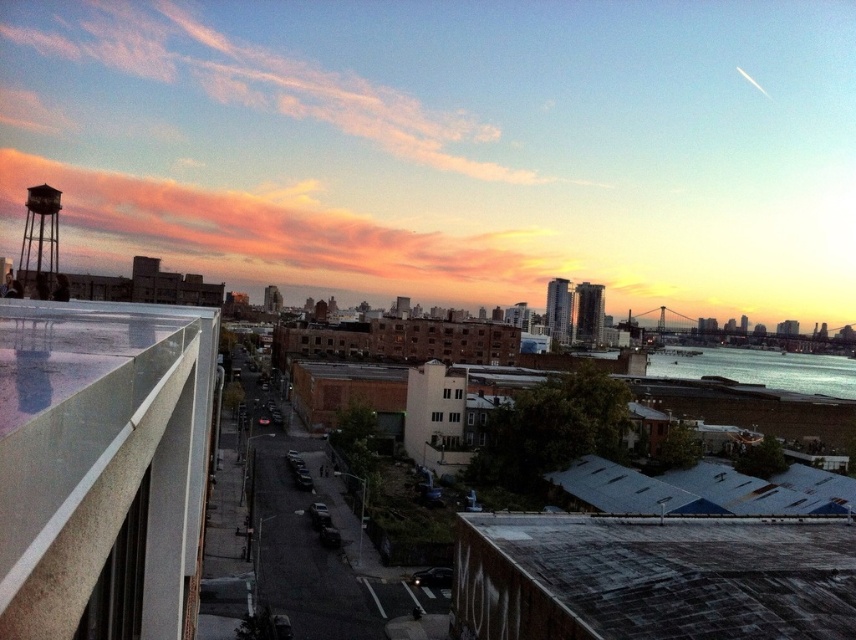
Does transparent glass balcony at upper left have a larger size compared to metallic water tower at upper left?

Incorrect, transparent glass balcony at upper left is not larger than metallic water tower at upper left.

Does transparent glass balcony at upper left have a greater width compared to metallic water tower at upper left?

In fact, transparent glass balcony at upper left might be narrower than metallic water tower at upper left.

Where is `transparent glass balcony at upper left`? This screenshot has width=856, height=640. transparent glass balcony at upper left is located at coordinates (98, 454).

Locate an element on the screen. Image resolution: width=856 pixels, height=640 pixels. transparent glass balcony at upper left is located at coordinates (98, 454).

Is transparent glass balcony at upper left positioned at the back of blue water at lower right?

No, transparent glass balcony at upper left is in front of blue water at lower right.

Is point (179, 321) in front of point (688, 378)?

Yes.

Locate an element on the screen. The image size is (856, 640). transparent glass balcony at upper left is located at coordinates (98, 454).

The height and width of the screenshot is (640, 856). What do you see at coordinates (758, 369) in the screenshot?
I see `blue water at lower right` at bounding box center [758, 369].

Is blue water at lower right below metallic water tower at upper left?

Correct, blue water at lower right is located below metallic water tower at upper left.

This screenshot has height=640, width=856. I want to click on blue water at lower right, so click(x=758, y=369).